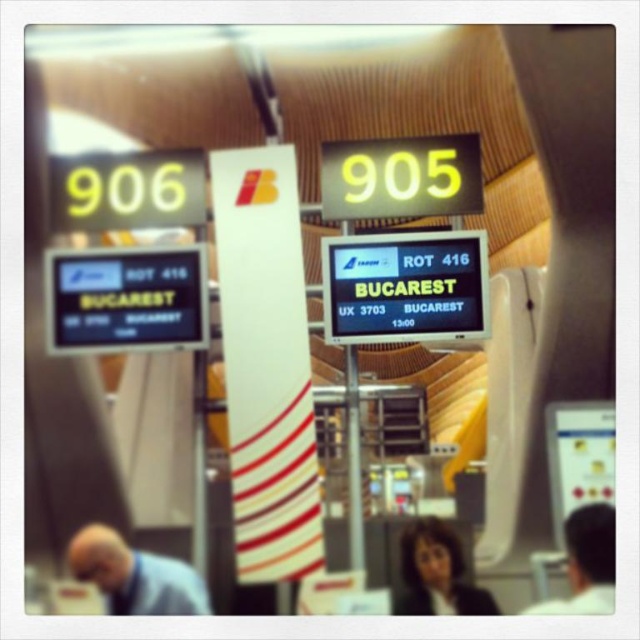
Does yellow digital display at center come behind light blue shirt at lower left?

That is True.

Describe the element at coordinates (404, 285) in the screenshot. I see `yellow digital display at center` at that location.

I want to click on yellow digital display at center, so click(x=404, y=285).

Measure the distance between dark brown hair at center and camera.

The distance of dark brown hair at center from camera is 3.44 meters.

Which is in front, point (410, 605) or point (588, 577)?

Point (588, 577) is in front.

Who is more distant from viewer, (x=445, y=600) or (x=570, y=580)?

The point (x=445, y=600) is more distant.

At what (x,y) coordinates should I click in order to perform the action: click on dark brown hair at center. Please return your answer as a coordinate pair (x, y). This screenshot has width=640, height=640. Looking at the image, I should click on (436, 573).

Is point (452, 138) closer to viewer compared to point (74, 205)?

Yes, point (452, 138) is in front of point (74, 205).

Can you confirm if yellow digital sign at center is positioned to the left of yellow digital sign at upper left?

No, yellow digital sign at center is not to the left of yellow digital sign at upper left.

Does point (429, 154) come in front of point (202, 200)?

Yes, point (429, 154) is in front of point (202, 200).

Identify the location of yellow digital sign at center. The width and height of the screenshot is (640, 640). (401, 177).